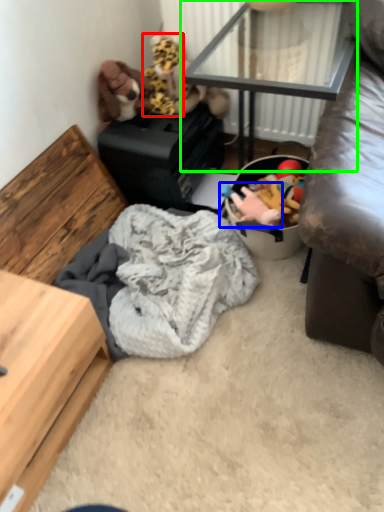
Question: Estimate the real-world distances between objects in this image. Which object is closer to toy (highlighted by a red box), toy (highlighted by a blue box) or table (highlighted by a green box)?

Choices:
 (A) toy
 (B) table

Answer: (B)